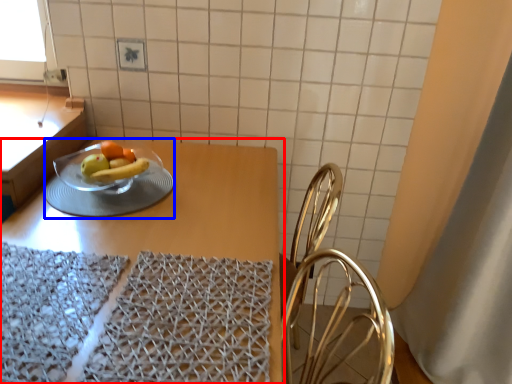
Question: Which point is closer to the camera, table (highlighted by a red box) or tableware (highlighted by a blue box)?

Choices:
 (A) table
 (B) tableware

Answer: (A)